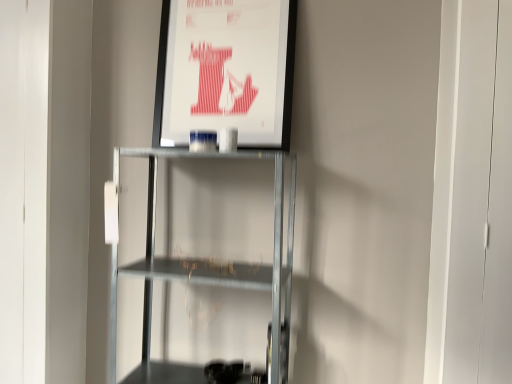
Question: Considering the relative sizes of metallic gray shelf at center and matte paper poster at upper center in the image provided, is metallic gray shelf at center shorter than matte paper poster at upper center?

Choices:
 (A) yes
 (B) no

Answer: (B)

Question: From a real-world perspective, is metallic gray shelf at center positioned over matte paper poster at upper center based on gravity?

Choices:
 (A) yes
 (B) no

Answer: (B)

Question: Is metallic gray shelf at center thinner than matte paper poster at upper center?

Choices:
 (A) yes
 (B) no

Answer: (B)

Question: From the image's perspective, is metallic gray shelf at center located beneath matte paper poster at upper center?

Choices:
 (A) no
 (B) yes

Answer: (B)

Question: Is the position of metallic gray shelf at center more distant than that of matte paper poster at upper center?

Choices:
 (A) no
 (B) yes

Answer: (A)

Question: Could you tell me if metallic gray shelf at center is facing matte paper poster at upper center?

Choices:
 (A) no
 (B) yes

Answer: (A)

Question: Can you confirm if matte paper poster at upper center is taller than metallic gray shelf at center?

Choices:
 (A) yes
 (B) no

Answer: (B)

Question: Can you confirm if matte paper poster at upper center is bigger than metallic gray shelf at center?

Choices:
 (A) no
 (B) yes

Answer: (A)

Question: Is matte paper poster at upper center outside metallic gray shelf at center?

Choices:
 (A) yes
 (B) no

Answer: (A)

Question: Would you say matte paper poster at upper center contains metallic gray shelf at center?

Choices:
 (A) no
 (B) yes

Answer: (A)

Question: Can you confirm if matte paper poster at upper center is positioned to the right of metallic gray shelf at center?

Choices:
 (A) yes
 (B) no

Answer: (A)

Question: Can you confirm if matte paper poster at upper center is smaller than metallic gray shelf at center?

Choices:
 (A) no
 (B) yes

Answer: (B)

Question: In terms of height, does matte paper poster at upper center look taller or shorter compared to metallic gray shelf at center?

Choices:
 (A) short
 (B) tall

Answer: (A)